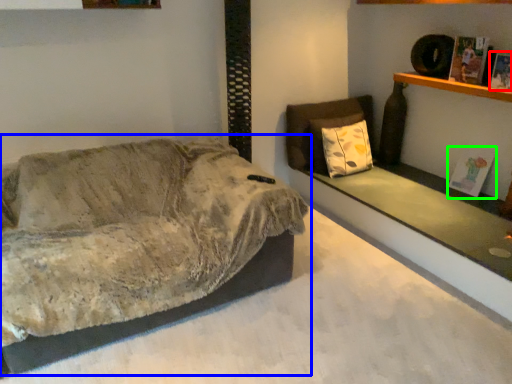
Question: Which object is the closest to the magazine (highlighted by a red box)? Choose among these: studio couch (highlighted by a blue box) or magazine (highlighted by a green box).

Choices:
 (A) studio couch
 (B) magazine

Answer: (B)